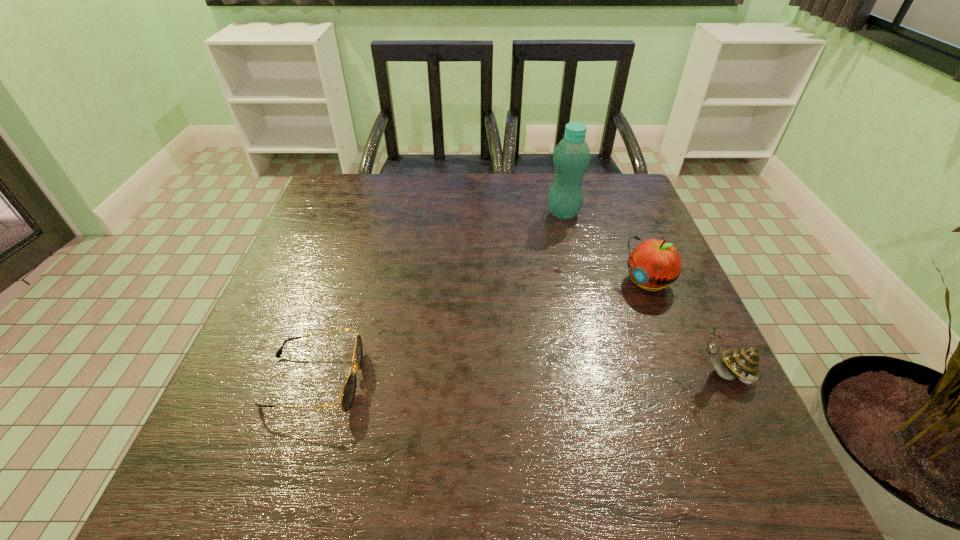
Identify the location of free space between the snail and the second object from left to right. The height and width of the screenshot is (540, 960). [643, 294].

You are a GUI agent. You are given a task and a screenshot of the screen. Output one action in this format:
    pyautogui.click(x=<x>, y=<y>)
    Task: Click on the free point between the shortest object and the third object from right to left
    This screenshot has height=540, width=960.
    Given the screenshot: What is the action you would take?
    (x=439, y=297)

I want to click on unoccupied area between the leftmost object and the second farthest object, so click(481, 332).

Locate an element on the screen. The height and width of the screenshot is (540, 960). free spot between the third nearest object and the snail is located at coordinates (685, 328).

Identify the location of free spot between the farthest object and the apple. (605, 247).

Identify the location of vacant point located between the snail and the water bottle. (643, 294).

Where is `vacant area that lies between the second farthest object and the second object from left to right`? Image resolution: width=960 pixels, height=540 pixels. vacant area that lies between the second farthest object and the second object from left to right is located at coordinates (605, 247).

This screenshot has height=540, width=960. In order to click on free space between the apple and the leftmost object in this screenshot , I will do `click(481, 332)`.

What are the coordinates of `empty location between the snail and the apple` in the screenshot? It's located at (685, 328).

In order to click on vacant area that lies between the snail and the leftmost object in this screenshot , I will do `click(518, 378)`.